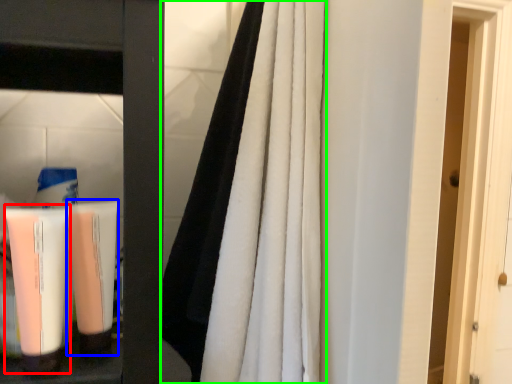
Question: Which is farther away from cleaning product (highlighted by a red box)? shaving cream (highlighted by a blue box) or curtain (highlighted by a green box)?

Choices:
 (A) shaving cream
 (B) curtain

Answer: (B)